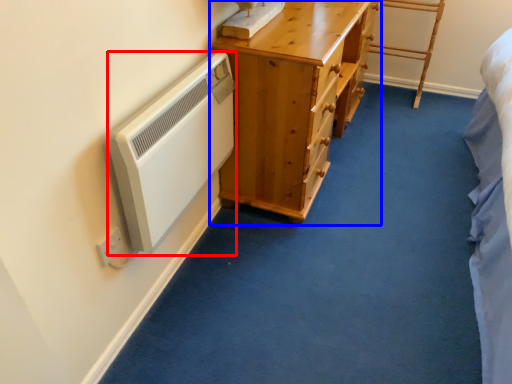
Question: Which point is closer to the camera, appliance (highlighted by a red box) or chest of drawers (highlighted by a blue box)?

Choices:
 (A) appliance
 (B) chest of drawers

Answer: (A)